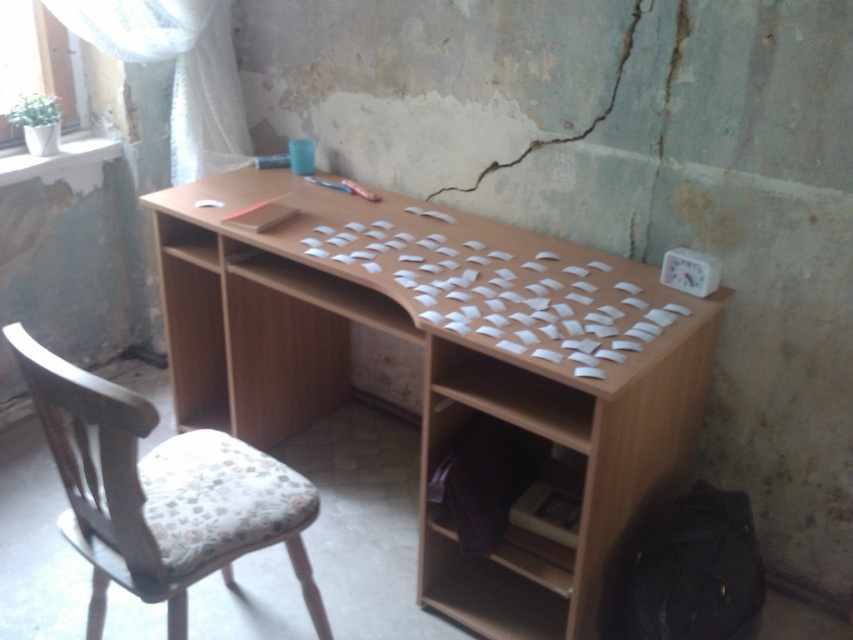
You are standing in the workspace and want to sit down. Where is the woodenwoodenchair at left located?

The woodenwoodenchair at left is located at point 0.772 on the x axis and 0.189 on the y axis.

You are an office worker who needs to adjust the lighting in your workspace. The light brown wood desk at center is currently under the white sheer curtain at upper left. Would moving the desk away from the curtain improve natural light on the desk?

The light brown wood desk at center is positioned under the white sheer curtain at upper left. Moving it away from the curtain could allow more natural light to reach the desk since the curtain might be blocking some light.